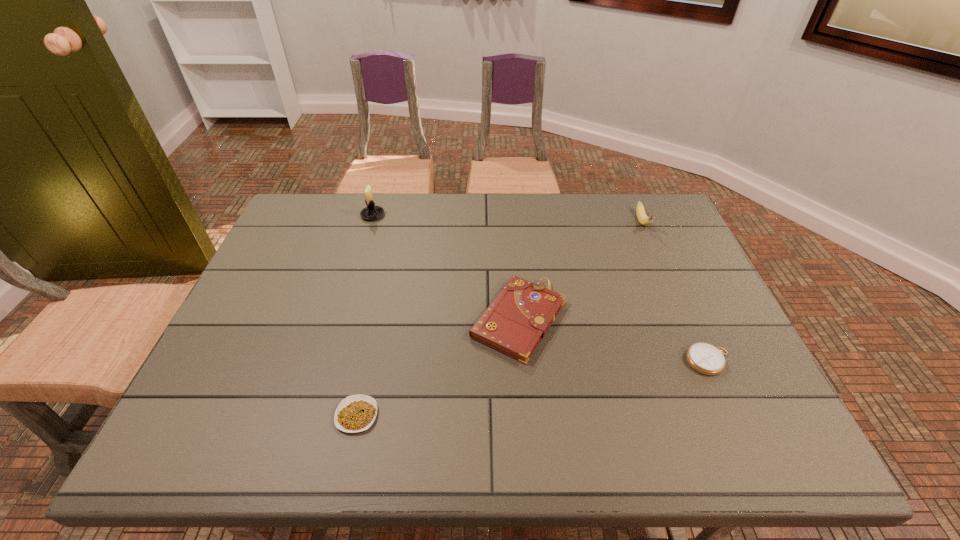
Locate an element on the screen. The height and width of the screenshot is (540, 960). vacant space at the near edge of the desktop is located at coordinates (533, 442).

Identify the location of free space at the left edge of the desktop. This screenshot has height=540, width=960. (251, 326).

Image resolution: width=960 pixels, height=540 pixels. In the image, there is a desktop. Find the location of `vacant space at the right edge`. vacant space at the right edge is located at coordinates (731, 353).

Locate an element on the screen. The image size is (960, 540). free point at the far left corner is located at coordinates (321, 218).

This screenshot has height=540, width=960. In the image, there is a desktop. Find the location of `free space at the near left corner`. free space at the near left corner is located at coordinates (173, 451).

Locate an element on the screen. This screenshot has width=960, height=540. unoccupied position between the banana and the compass is located at coordinates (676, 292).

At what (x,y) coordinates should I click in order to perform the action: click on vacant area that lies between the nearest object and the candle holder. Please return your answer as a coordinate pair (x, y). The image size is (960, 540). Looking at the image, I should click on (365, 315).

Locate an element on the screen. Image resolution: width=960 pixels, height=540 pixels. free spot between the notebook and the second tallest object is located at coordinates (581, 271).

At what (x,y) coordinates should I click in order to perform the action: click on vacant space in between the tallest object and the legume. Please return your answer as a coordinate pair (x, y). The image size is (960, 540). Looking at the image, I should click on (365, 315).

The height and width of the screenshot is (540, 960). I want to click on vacant area that lies between the third shortest object and the fourth object from right to left, so click(438, 367).